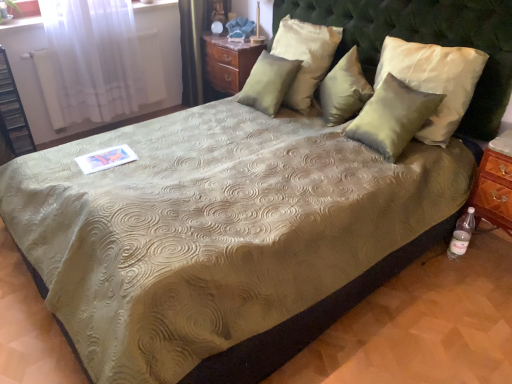
Where is `vacant space to the left of clear plastic bottle at lower right`? vacant space to the left of clear plastic bottle at lower right is located at coordinates (431, 264).